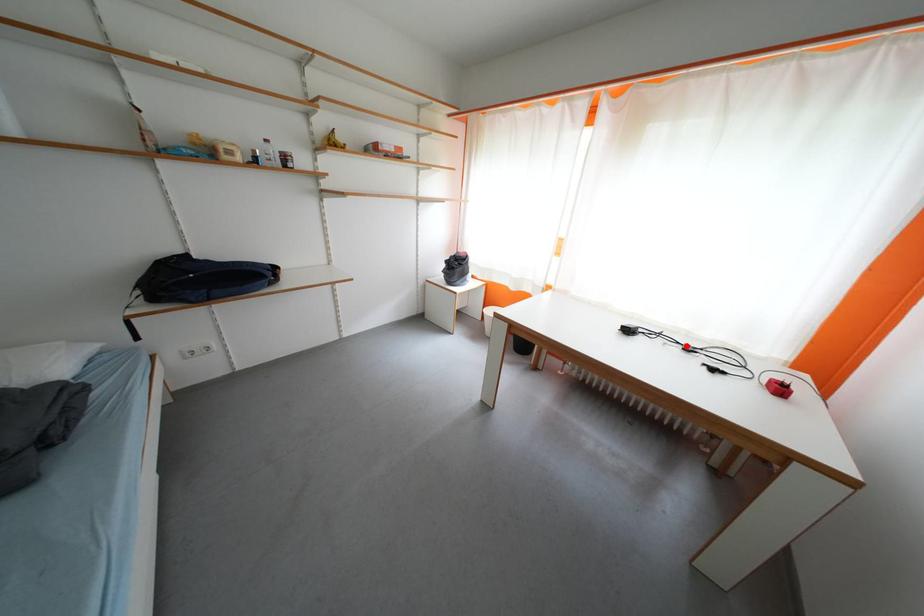
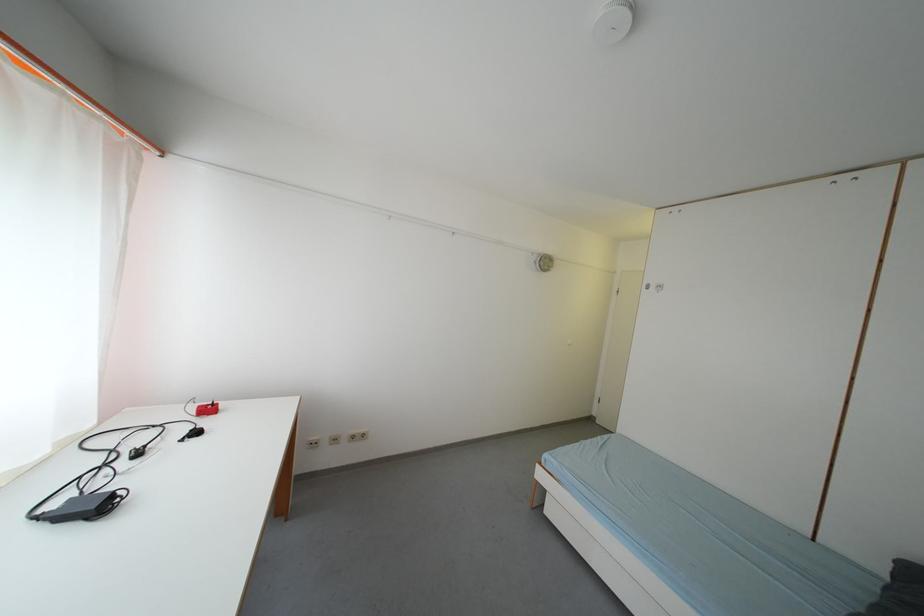
Where in the second image is the point corresponding to the highlighted location from the first image?

(112, 469)